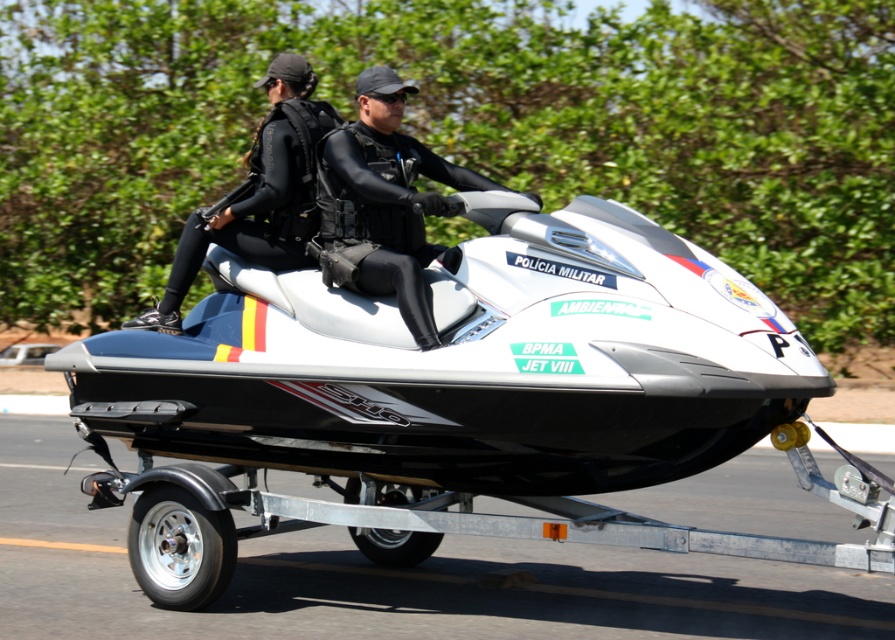
Does black matte wetsuit at center appear over black matte wetsuit at left?

Actually, black matte wetsuit at center is below black matte wetsuit at left.

Is black matte wetsuit at center below black matte wetsuit at left?

Yes, black matte wetsuit at center is below black matte wetsuit at left.

Is point (491, 184) closer to camera compared to point (292, 60)?

Yes, it is.

Identify the location of black matte wetsuit at center. Image resolution: width=895 pixels, height=640 pixels. (384, 202).

Is white matte jet ski at center closer to camera compared to black matte wetsuit at center?

Yes, white matte jet ski at center is in front of black matte wetsuit at center.

Who is higher up, white matte jet ski at center or black matte wetsuit at center?

black matte wetsuit at center is higher up.

The height and width of the screenshot is (640, 895). Describe the element at coordinates (457, 400) in the screenshot. I see `white matte jet ski at center` at that location.

Locate an element on the screen. This screenshot has height=640, width=895. white matte jet ski at center is located at coordinates (457, 400).

Measure the distance between white matte jet ski at center and black matte wetsuit at left.

They are 4.39 feet apart.

Between point (706, 438) and point (293, 248), which one is positioned behind?

Point (293, 248)

Who is more forward, (209,531) or (293,184)?

Point (209,531) is in front.

Locate an element on the screen. white matte jet ski at center is located at coordinates (457, 400).